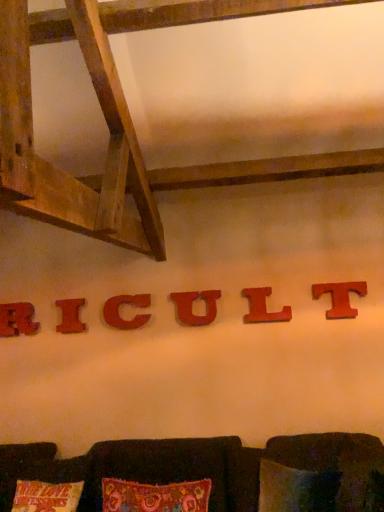
Question: From a real-world perspective, is brown fabric couch at lower center positioned under red matte letter l at center, the fifth alphabet viewed from the left, based on gravity?

Choices:
 (A) yes
 (B) no

Answer: (A)

Question: Is brown fabric couch at lower center oriented away from red matte letter l at center, the second alphabet from the right?

Choices:
 (A) no
 (B) yes

Answer: (A)

Question: Is brown fabric couch at lower center next to red matte letter l at center, the fifth alphabet viewed from the left, and touching it?

Choices:
 (A) no
 (B) yes

Answer: (A)

Question: Is brown fabric couch at lower center completely or partially outside of red matte letter l at center, the second alphabet from the right?

Choices:
 (A) yes
 (B) no

Answer: (A)

Question: From a real-world perspective, is brown fabric couch at lower center physically above red matte letter l at center, the second alphabet from the right?

Choices:
 (A) no
 (B) yes

Answer: (A)

Question: Is red matte letter l at center, the second alphabet from the right, in front of or behind red wood letter t at center right, which is counted as the first alphabet, starting from the right, in the image?

Choices:
 (A) behind
 (B) front

Answer: (A)

Question: From a real-world perspective, relative to red wood letter t at center right, which is counted as the sixth alphabet, starting from the left, is red matte letter l at center, the second alphabet from the right, vertically above or below?

Choices:
 (A) above
 (B) below

Answer: (B)

Question: From the image's perspective, is red matte letter l at center, the fifth alphabet viewed from the left, positioned above or below red wood letter t at center right, which is counted as the first alphabet, starting from the right?

Choices:
 (A) above
 (B) below

Answer: (B)

Question: Considering the positions of point (276, 315) and point (344, 298), is point (276, 315) closer or farther from the camera than point (344, 298)?

Choices:
 (A) closer
 (B) farther

Answer: (B)

Question: From their relative heights in the image, would you say wooden letter "i" at center, the 2th alphabet in the left-to-right sequence, is taller or shorter than wooden letter r at center, which appears as the 6th alphabet when viewed from the right?

Choices:
 (A) tall
 (B) short

Answer: (B)

Question: Considering their positions, is wooden letter "i" at center, the 2th alphabet in the left-to-right sequence, located in front of or behind wooden letter r at center, which appears as the 6th alphabet when viewed from the right?

Choices:
 (A) front
 (B) behind

Answer: (A)

Question: Which is correct: wooden letter "i" at center, the 2th alphabet in the left-to-right sequence, is inside wooden letter r at center, which ranks as the first alphabet in left-to-right order, or outside of it?

Choices:
 (A) inside
 (B) outside

Answer: (B)

Question: From the image's perspective, relative to wooden letter r at center, which ranks as the first alphabet in left-to-right order, is wooden letter "i" at center, the 2th alphabet in the left-to-right sequence, above or below?

Choices:
 (A) below
 (B) above

Answer: (B)

Question: Considering the positions of red matte letter l at center, the second alphabet from the right, and brown fabric couch at lower center in the image, is red matte letter l at center, the second alphabet from the right, taller or shorter than brown fabric couch at lower center?

Choices:
 (A) tall
 (B) short

Answer: (B)

Question: From the image's perspective, is red matte letter l at center, the second alphabet from the right, above or below brown fabric couch at lower center?

Choices:
 (A) above
 (B) below

Answer: (A)